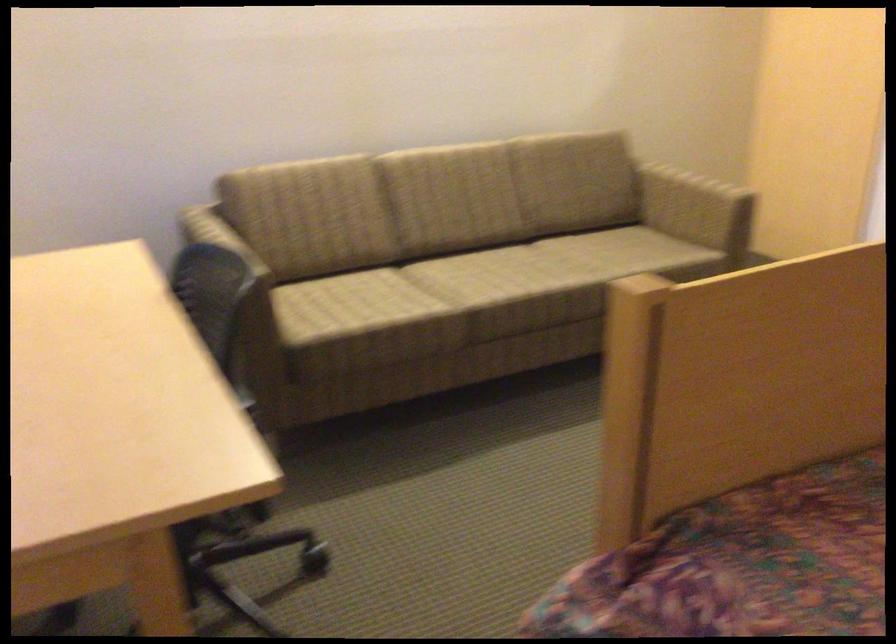
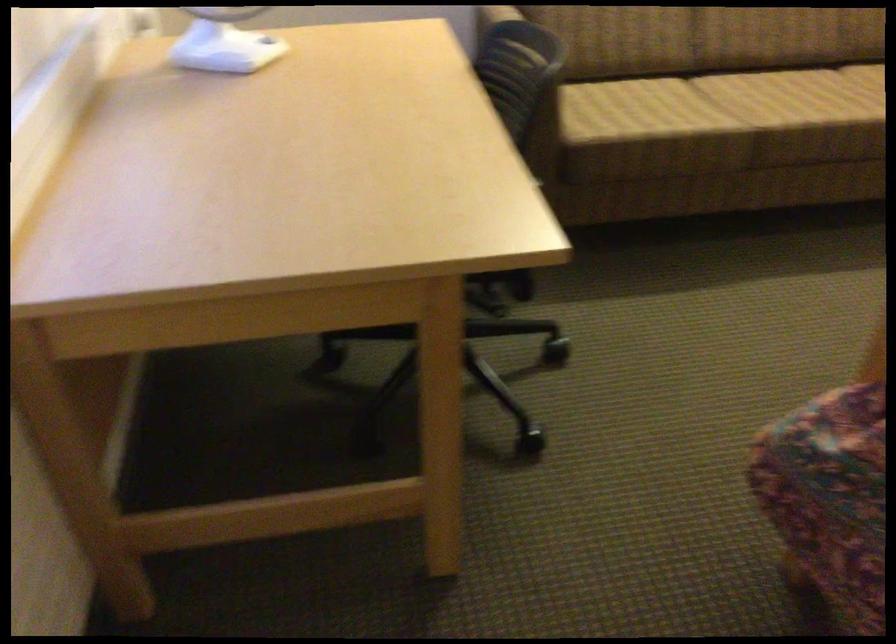
In a continuous first-person perspective shot, in which direction is the camera moving?

The movement direction of the cameraman is left, backward.